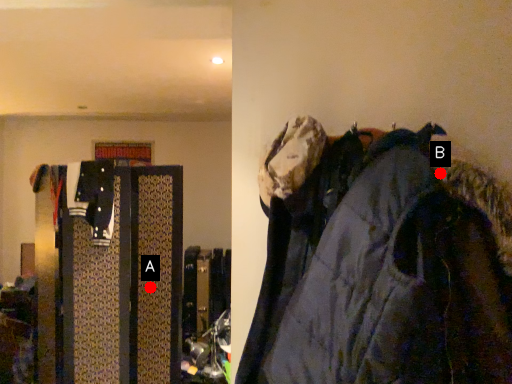
Question: Two points are circled on the image, labeled by A and B beside each circle. Which point is closer to the camera taking this photo?

Choices:
 (A) A is closer
 (B) B is closer

Answer: (B)